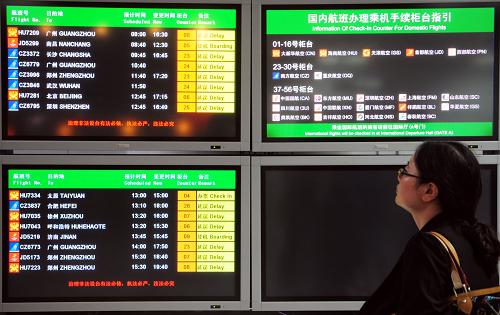
The height and width of the screenshot is (315, 500). What are the coordinates of `blank screen` in the screenshot? It's located at (374, 254).